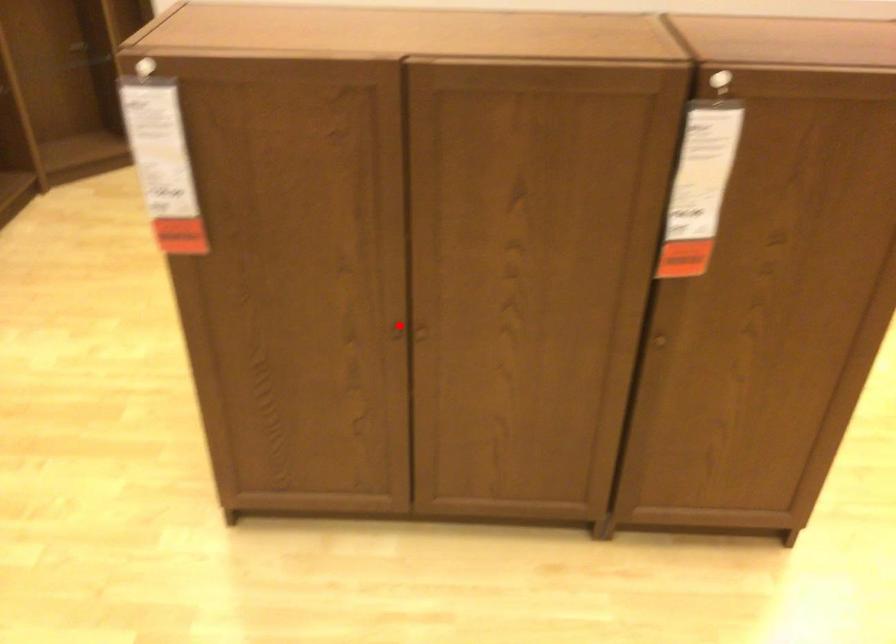
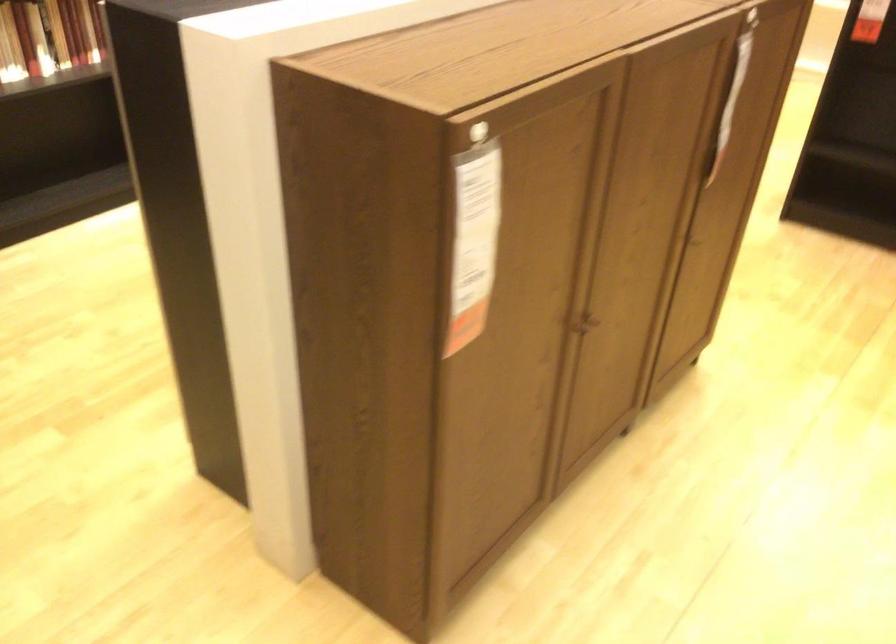
The point at the highlighted location is marked in the first image. Where is the corresponding point in the second image?

(583, 323)